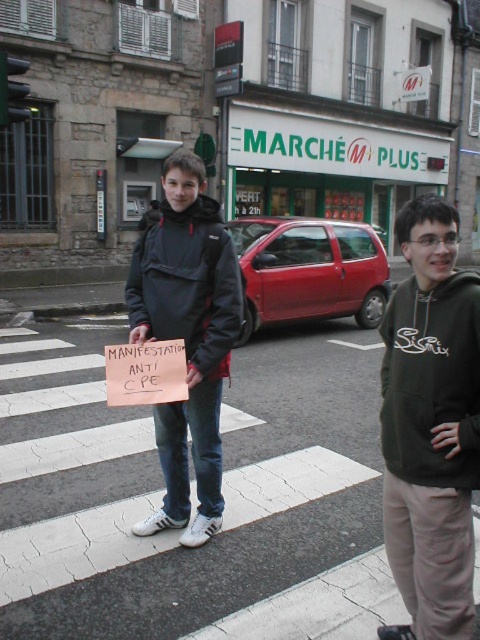
You are a delivery person needing to place a package between the dark green hoodie at center and the matte black jacket at center. The package requires 3.5 feet of space. Is there enough room?

The dark green hoodie at center is 4.00 feet away from the matte black jacket at center, so yes, there is enough room to place the package between them since the distance is greater than the required 3.5 feet.

You are a delivery person needing to hand a package to the person wearing the dark green hoodie at center. You are currently at the pedestrian crossing. Can you directly hand the package to them without needing to move around the matte black jacket at center?

The dark green hoodie at center is in front of the matte black jacket at center, so you can directly hand the package to the dark green hoodie at center without needing to move around the matte black jacket at center.